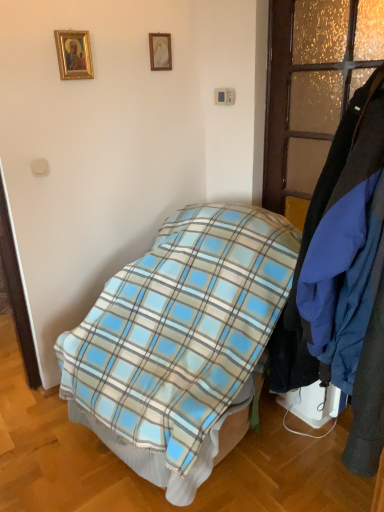
What do you see at coordinates (160, 51) in the screenshot?
I see `matte gold picture frame at upper center, which is counted as the second picture frame, starting from the left` at bounding box center [160, 51].

Where is `blue fabric coat at right`? blue fabric coat at right is located at coordinates (348, 274).

Where is `gold-framed picture at upper left, arranged as the 1th picture frame when viewed from the left`? The image size is (384, 512). gold-framed picture at upper left, arranged as the 1th picture frame when viewed from the left is located at coordinates (74, 54).

Between blue fabric coat at right and blue plaid blanket at center, which one has smaller size?

Smaller between the two is blue fabric coat at right.

From a real-world perspective, which object rests below the other?

blue plaid blanket at center, from a real-world perspective.

Can you tell me how much blue fabric coat at right and blue plaid blanket at center differ in facing direction?

There is a 6.42-degree angle between the facing directions of blue fabric coat at right and blue plaid blanket at center.

How far apart are blue fabric coat at right and blue plaid blanket at center?

blue fabric coat at right is 28.03 inches away from blue plaid blanket at center.

From the image's perspective, is blue fabric coat at right located above or below gold-framed picture at upper left, which is the 2th picture frame in right-to-left order?

Clearly, from the image's perspective, blue fabric coat at right is below gold-framed picture at upper left, which is the 2th picture frame in right-to-left order.

Which object is positioned more to the left, blue fabric coat at right or gold-framed picture at upper left, arranged as the 1th picture frame when viewed from the front?

Positioned to the left is gold-framed picture at upper left, arranged as the 1th picture frame when viewed from the front.

Based on the photo, between blue fabric coat at right and gold-framed picture at upper left, arranged as the 1th picture frame when viewed from the left, which one has smaller size?

gold-framed picture at upper left, arranged as the 1th picture frame when viewed from the left, is smaller.

Based on the photo, considering the sizes of blue fabric coat at right and gold-framed picture at upper left, the 2th picture frame when ordered from back to front, in the image, is blue fabric coat at right wider or thinner than gold-framed picture at upper left, the 2th picture frame when ordered from back to front,?

Considering their sizes, blue fabric coat at right looks broader than gold-framed picture at upper left, the 2th picture frame when ordered from back to front.

Would you say matte gold picture frame at upper center, which is counted as the first picture frame, starting from the right, is to the left or to the right of blue fabric coat at right in the picture?

In the image, matte gold picture frame at upper center, which is counted as the first picture frame, starting from the right, appears on the left side of blue fabric coat at right.

Is matte gold picture frame at upper center, the first picture frame in the back-to-front sequence, aimed at blue fabric coat at right?

No, matte gold picture frame at upper center, the first picture frame in the back-to-front sequence, does not turn towards blue fabric coat at right.

From the picture: Which object is closer to the camera, matte gold picture frame at upper center, the first picture frame in the back-to-front sequence, or blue fabric coat at right?

Positioned in front is blue fabric coat at right.

Considering the relative sizes of blue fabric coat at right and matte gold picture frame at upper center, the first picture frame in the back-to-front sequence, in the image provided, is blue fabric coat at right shorter than matte gold picture frame at upper center, the first picture frame in the back-to-front sequence,?

No.

How different are the orientations of blue fabric coat at right and matte gold picture frame at upper center, which is counted as the second picture frame, starting from the left, in degrees?

The angle between the facing direction of blue fabric coat at right and the facing direction of matte gold picture frame at upper center, which is counted as the second picture frame, starting from the left, is 91 degrees.

Is blue fabric coat at right inside or outside of matte gold picture frame at upper center, which is counted as the second picture frame, starting from the left?

blue fabric coat at right is located beyond the bounds of matte gold picture frame at upper center, which is counted as the second picture frame, starting from the left.

Is blue fabric coat at right not close to matte gold picture frame at upper center, which is counted as the second picture frame, starting from the left?

blue fabric coat at right is far away from matte gold picture frame at upper center, which is counted as the second picture frame, starting from the left.

Can you confirm if blue plaid blanket at center is positioned to the left of translucent frosted glass door at right?

Yes, blue plaid blanket at center is to the left of translucent frosted glass door at right.

Consider the image. Is blue plaid blanket at center positioned before translucent frosted glass door at right?

Yes, blue plaid blanket at center is in front of translucent frosted glass door at right.

Identify the location of glass door on the right side of blue plaid blanket at center. (313, 85).

Are blue plaid blanket at center and translucent frosted glass door at right far apart?

blue plaid blanket at center is actually quite close to translucent frosted glass door at right.

Is translucent frosted glass door at right far away from blue fabric coat at right?

No.

From the image's perspective, is translucent frosted glass door at right on blue fabric coat at right?

Correct, translucent frosted glass door at right appears higher than blue fabric coat at right in the image.

Considering the positions of objects translucent frosted glass door at right and blue fabric coat at right in the image provided, who is behind, translucent frosted glass door at right or blue fabric coat at right?

Positioned behind is translucent frosted glass door at right.

From a real-world perspective, who is located lower, translucent frosted glass door at right or blue fabric coat at right?

blue fabric coat at right.

Considering the relative sizes of matte gold picture frame at upper center, the first picture frame in the back-to-front sequence, and gold-framed picture at upper left, the 2th picture frame when ordered from back to front, in the image provided, is matte gold picture frame at upper center, the first picture frame in the back-to-front sequence, smaller than gold-framed picture at upper left, the 2th picture frame when ordered from back to front,?

Yes, matte gold picture frame at upper center, the first picture frame in the back-to-front sequence, is smaller than gold-framed picture at upper left, the 2th picture frame when ordered from back to front.

From a real-world perspective, is matte gold picture frame at upper center, arranged as the 2th picture frame when viewed from the front, below gold-framed picture at upper left, the 2th picture frame when ordered from back to front?

No, from a real-world perspective, matte gold picture frame at upper center, arranged as the 2th picture frame when viewed from the front, is not beneath gold-framed picture at upper left, the 2th picture frame when ordered from back to front.

Does matte gold picture frame at upper center, which is counted as the first picture frame, starting from the right, appear on the left side of gold-framed picture at upper left, the 2th picture frame when ordered from back to front?

Incorrect, matte gold picture frame at upper center, which is counted as the first picture frame, starting from the right, is not on the left side of gold-framed picture at upper left, the 2th picture frame when ordered from back to front.

Is matte gold picture frame at upper center, which is counted as the first picture frame, starting from the right, located outside gold-framed picture at upper left, the 2th picture frame when ordered from back to front?

Yes, matte gold picture frame at upper center, which is counted as the first picture frame, starting from the right, is located beyond the bounds of gold-framed picture at upper left, the 2th picture frame when ordered from back to front.

Identify the location of bed that appears below the blue fabric coat at right (from the image's perspective). (179, 340).

The height and width of the screenshot is (512, 384). Find the location of `picture frame that is the 1st one above the blue fabric coat at right (from a real-world perspective)`. picture frame that is the 1st one above the blue fabric coat at right (from a real-world perspective) is located at coordinates (74, 54).

From the image, which object appears to be farther from matte gold picture frame at upper center, the first picture frame in the back-to-front sequence, blue plaid blanket at center or translucent frosted glass door at right?

blue plaid blanket at center lies further to matte gold picture frame at upper center, the first picture frame in the back-to-front sequence, than the other object.

Looking at the image, which one is located closer to blue fabric coat at right, matte gold picture frame at upper center, which is counted as the second picture frame, starting from the left, or blue plaid blanket at center?

blue plaid blanket at center is positioned closer to the anchor blue fabric coat at right.

Based on their spatial positions, is gold-framed picture at upper left, arranged as the 1th picture frame when viewed from the left, or blue plaid blanket at center further from matte gold picture frame at upper center, arranged as the 2th picture frame when viewed from the front?

blue plaid blanket at center is further to matte gold picture frame at upper center, arranged as the 2th picture frame when viewed from the front.

Looking at the image, which one is located further to gold-framed picture at upper left, which is the 2th picture frame in right-to-left order, matte gold picture frame at upper center, arranged as the 2th picture frame when viewed from the front, or blue fabric coat at right?

blue fabric coat at right is further to gold-framed picture at upper left, which is the 2th picture frame in right-to-left order.

Looking at the image, which one is located closer to blue fabric coat at right, gold-framed picture at upper left, arranged as the 1th picture frame when viewed from the front, or blue plaid blanket at center?

Based on the image, blue plaid blanket at center appears to be nearer to blue fabric coat at right.

Looking at the image, which one is located further to matte gold picture frame at upper center, the first picture frame in the back-to-front sequence, blue fabric coat at right or gold-framed picture at upper left, the 2th picture frame when ordered from back to front?

blue fabric coat at right lies further to matte gold picture frame at upper center, the first picture frame in the back-to-front sequence, than the other object.

Looking at the image, which one is located further to matte gold picture frame at upper center, the first picture frame in the back-to-front sequence, translucent frosted glass door at right or gold-framed picture at upper left, which is the 2th picture frame in right-to-left order?

translucent frosted glass door at right is further to matte gold picture frame at upper center, the first picture frame in the back-to-front sequence.

Considering their positions, is matte gold picture frame at upper center, the first picture frame in the back-to-front sequence, positioned closer to blue fabric coat at right than translucent frosted glass door at right?

The object closer to blue fabric coat at right is translucent frosted glass door at right.

I want to click on closet between matte gold picture frame at upper center, the first picture frame in the back-to-front sequence, and blue plaid blanket at center from top to bottom, so click(348, 274).

Locate an element on the screen. glass door between matte gold picture frame at upper center, which is counted as the second picture frame, starting from the left, and blue fabric coat at right is located at coordinates (313, 85).

You are a GUI agent. You are given a task and a screenshot of the screen. Output one action in this format:
    pyautogui.click(x=<x>, y=<y>)
    Task: Click on the glass door between gold-framed picture at upper left, arranged as the 1th picture frame when viewed from the front, and blue fabric coat at right, in the horizontal direction
    This screenshot has height=512, width=384.
    Given the screenshot: What is the action you would take?
    pyautogui.click(x=313, y=85)

The image size is (384, 512). Identify the location of picture frame between gold-framed picture at upper left, the 2th picture frame when ordered from back to front, and blue fabric coat at right, in the horizontal direction. (160, 51).